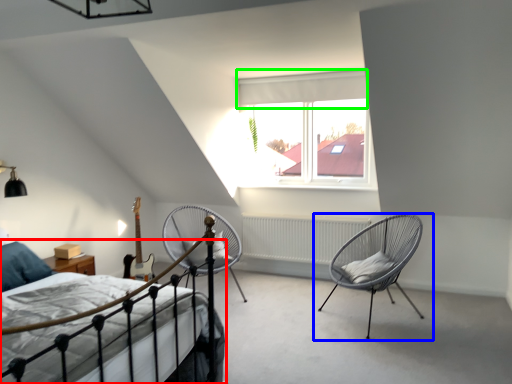
Question: Considering the real-world distances, which object is farthest from bed (highlighted by a red box)? chair (highlighted by a blue box) or curtain (highlighted by a green box)?

Choices:
 (A) chair
 (B) curtain

Answer: (B)